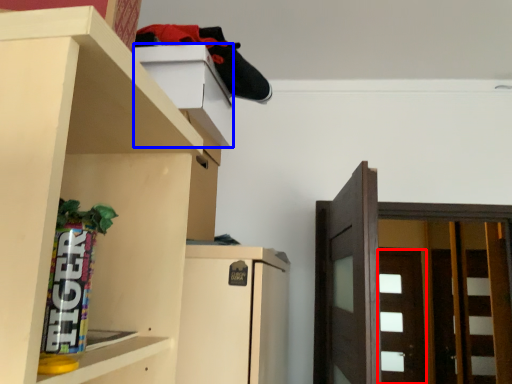
Question: Which object is closer to the camera taking this photo, door (highlighted by a red box) or cabinet (highlighted by a blue box)?

Choices:
 (A) door
 (B) cabinet

Answer: (B)